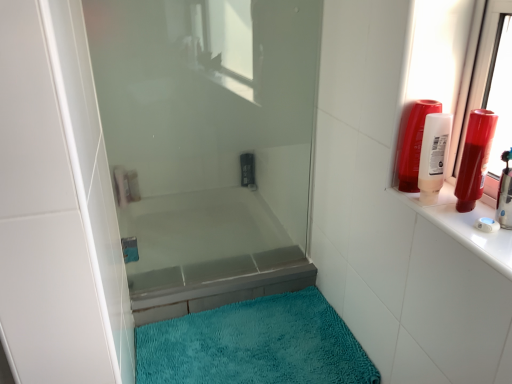
Question: Is point (478, 187) positioned closer to the camera than point (200, 231)?

Choices:
 (A) farther
 (B) closer

Answer: (B)

Question: Is shiny red tube at upper right, arranged as the 1th toiletry when viewed from the front, inside the boundaries of transparent glass shower door at center, or outside?

Choices:
 (A) inside
 (B) outside

Answer: (B)

Question: Considering the real-world distances, which object is closest to the white matte soap dispenser at upper left, which appears as the 5th toiletry when viewed from the right?

Choices:
 (A) matte black control panel at center, placed as the third toiletry when sorted from left to right
 (B) matte plastic soap dispenser at upper left, the 1th toiletry in the left-to-right sequence
 (C) transparent glass shower door at center
 (D) teal plush bath mat at lower center
 (E) shiny red tube at upper right, the 6th toiletry viewed from the left

Answer: (B)

Question: Estimate the real-world distances between objects in this image. Which object is closer to the translucent plastic shampoo bottle at upper right, arranged as the fourth toiletry when viewed from the left?

Choices:
 (A) shiny red tube at upper right, the 6th toiletry from the back
 (B) matte white bottle at upper right, the second toiletry when ordered from right to left
 (C) matte black control panel at center, which is counted as the fourth toiletry, starting from the right
 (D) matte plastic soap dispenser at upper left, the 1th toiletry in the left-to-right sequence
 (E) transparent glass shower door at center

Answer: (B)